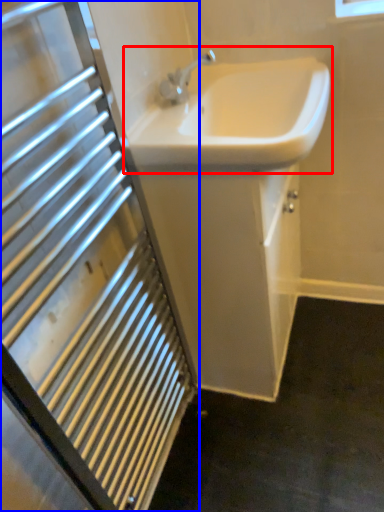
Question: Which object appears farthest to the camera in this image, sink (highlighted by a red box) or bathroom cabinet (highlighted by a blue box)?

Choices:
 (A) sink
 (B) bathroom cabinet

Answer: (A)